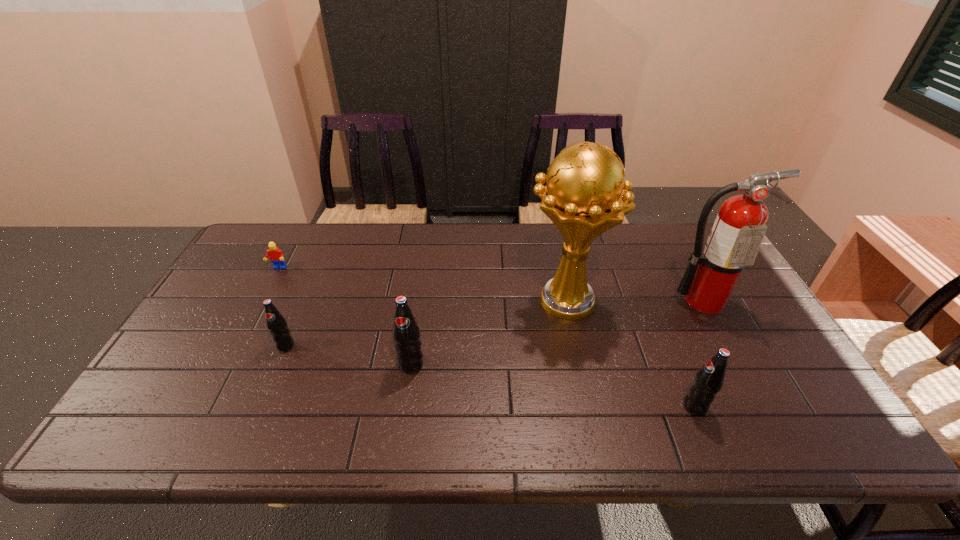
The height and width of the screenshot is (540, 960). What are the coordinates of `object located in the near edge section of the desktop` in the screenshot? It's located at (709, 380).

Find the location of a particular element. object present at the left edge is located at coordinates (276, 256).

In order to click on object present at the right edge in this screenshot , I will do `click(739, 228)`.

Where is `object at the far left corner`? The height and width of the screenshot is (540, 960). object at the far left corner is located at coordinates (276, 256).

At what (x,y) coordinates should I click in order to perform the action: click on vacant space at the far edge. Please return your answer as a coordinate pair (x, y). The width and height of the screenshot is (960, 540). Looking at the image, I should click on (514, 251).

Find the location of a particular element. The image size is (960, 540). blank space at the near edge of the desktop is located at coordinates (409, 381).

Locate an element on the screen. vacant space at the left edge of the desktop is located at coordinates [275, 273].

What are the coordinates of `free space at the right edge of the desktop` in the screenshot? It's located at (743, 299).

Identify the location of blank space at the near left corner of the desktop. This screenshot has width=960, height=540. (156, 393).

In the image, there is a desktop. Identify the location of vacant space at the far right corner. click(680, 223).